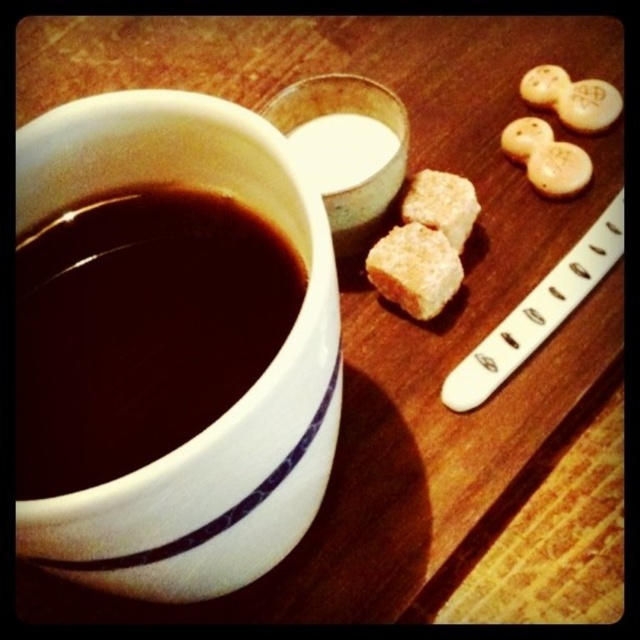
You are a barista preparing a drink and need to choose between the brown sugar cube at center and the brown sugar cubes at center. Which one has a larger width?

The brown sugar cube at center has a larger width than the brown sugar cubes at center.

Based on the photo, you are holding a small toy that is 10 inches long. You want to place it on the table so that it reaches from the edge of the cup to the point at coordinates point (422, 294). Will the toy fit without overlapping the cup or the bowl?

The point at coordinates point (422, 294) is 18.89 inches away from the viewer. Since the toy is only 10 inches long, it will not be long enough to reach from the edge of the cup to the point at coordinates point (422, 294) without overlapping the cup or the bowl.